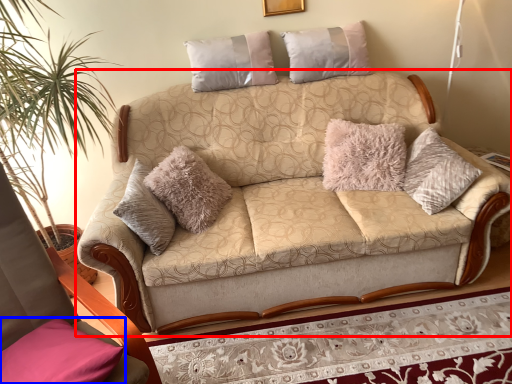
Question: Which object appears farthest to the camera in this image, studio couch (highlighted by a red box) or pillow (highlighted by a blue box)?

Choices:
 (A) studio couch
 (B) pillow

Answer: (A)